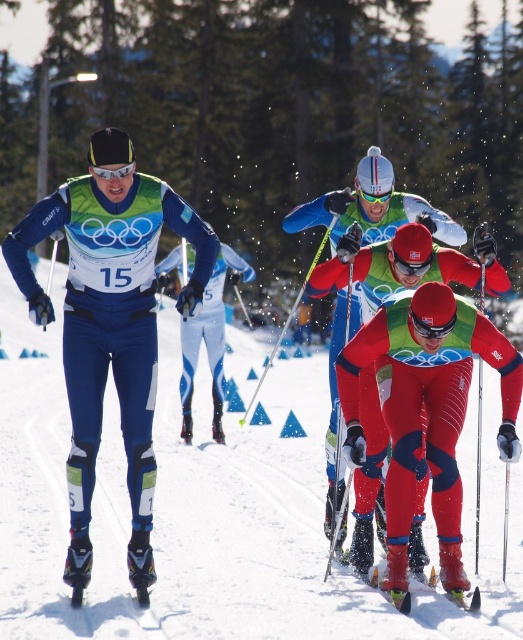
You are a photographer positioned at the starting line of the cross country skiing event. You want to take a photo that includes both the point at location (414, 429) and the point at (449, 596). Which point should you focus on first to ensure both are in focus?

You should focus on point (414, 429) first because it is closer to the viewer than point (449, 596), allowing the camera to capture both points within the depth of field.

You are a photographer positioned at the starting line of the cross country skiing event. You want to take a photo of the two skiers wearing the matte blue ski suit at center and green matte ski at center. Which skier will appear larger in your photo?

The matte blue ski suit at center will appear larger in the photo because it is closer to the viewer than the green matte ski at center.

You are a photographer at the cross country skiing event. You want to capture a photo of the red matte ski suit at center and the green matte ski at center. Which one is positioned higher in the image?

The red matte ski suit at center is above the green matte ski at center, so it is positioned higher in the image.